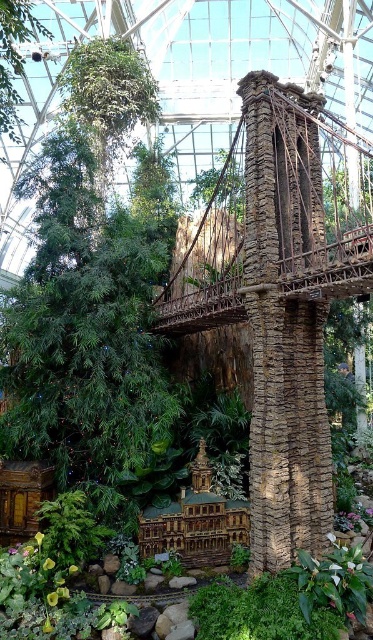
Does green leafy tree at center appear over green leafy tree at upper left?

Incorrect, green leafy tree at center is not positioned above green leafy tree at upper left.

Who is more forward, (120, 326) or (0, 61)?

Positioned in front is point (120, 326).

The height and width of the screenshot is (640, 373). I want to click on green leafy tree at center, so click(88, 291).